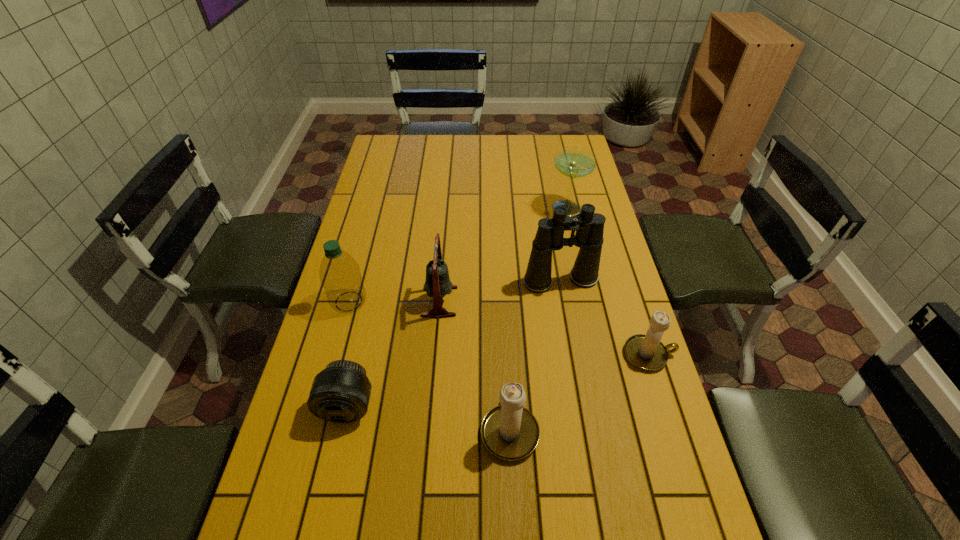
At what (x,y) coordinates should I click in order to perform the action: click on vacant space located 0.250m on the handle side of the left candle holder. Please return your answer as a coordinate pair (x, y). The image size is (960, 540). Looking at the image, I should click on (504, 319).

The height and width of the screenshot is (540, 960). What are the coordinates of `vacant space located on the handle side of the left candle holder` in the screenshot? It's located at (504, 305).

Where is `vacant space situated 0.300m on the left of the martini`? vacant space situated 0.300m on the left of the martini is located at coordinates (461, 209).

Identify the location of vacant region located 0.300m on the right of the water bottle. Image resolution: width=960 pixels, height=540 pixels. (468, 301).

Locate an element on the screen. free space located 0.250m on the back of the bell is located at coordinates (445, 231).

Image resolution: width=960 pixels, height=540 pixels. I want to click on vacant space located on the back of the binoculars, so click(557, 258).

The image size is (960, 540). In order to click on vacant area located 0.180m on the front-facing side of the shortest object in this screenshot , I will do `click(324, 511)`.

This screenshot has height=540, width=960. What are the coordinates of `water bottle present at the left edge` in the screenshot? It's located at (340, 275).

This screenshot has width=960, height=540. I want to click on telephoto lens situated at the left edge, so coord(340,393).

You are a GUI agent. You are given a task and a screenshot of the screen. Output one action in this format:
    pyautogui.click(x=<x>, y=<y>)
    Task: Click on the candle holder that is positioned at the right edge
    This screenshot has height=540, width=960.
    Given the screenshot: What is the action you would take?
    pyautogui.click(x=646, y=352)